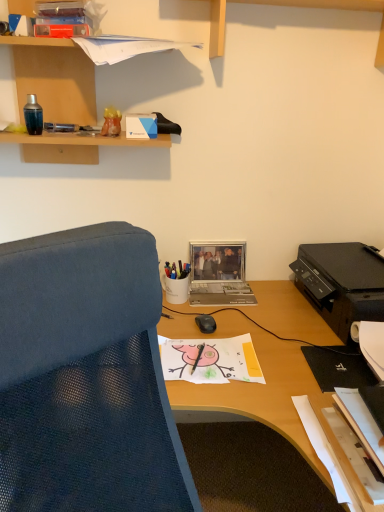
Question: Is metallic silver laptop at center facing away from black matte pen at center, marked as the 1th pen in a front-to-back arrangement?

Choices:
 (A) yes
 (B) no

Answer: (B)

Question: Does metallic silver laptop at center touch black matte pen at center, arranged as the 2th pen when viewed from the top?

Choices:
 (A) yes
 (B) no

Answer: (B)

Question: Considering the relative positions of metallic silver laptop at center and black matte pen at center, which is the first pen in bottom-to-top order, in the image provided, is metallic silver laptop at center to the left of black matte pen at center, which is the first pen in bottom-to-top order, from the viewer's perspective?

Choices:
 (A) yes
 (B) no

Answer: (B)

Question: From the image's perspective, is metallic silver laptop at center below black matte pen at center, which is the first pen in bottom-to-top order?

Choices:
 (A) yes
 (B) no

Answer: (B)

Question: Is the position of metallic silver laptop at center less distant than that of black matte pen at center, the second pen in the back-to-front sequence?

Choices:
 (A) no
 (B) yes

Answer: (A)

Question: Is black plastic printer at right situated inside translucent orange vase at upper left, placed as the first stationery when sorted from top to bottom, or outside?

Choices:
 (A) outside
 (B) inside

Answer: (A)

Question: From the image's perspective, relative to translucent orange vase at upper left, acting as the 1th stationery starting from the left, is black plastic printer at right above or below?

Choices:
 (A) below
 (B) above

Answer: (A)

Question: Is black plastic printer at right to the left or to the right of translucent orange vase at upper left, placed as the first stationery when sorted from top to bottom, in the image?

Choices:
 (A) left
 (B) right

Answer: (B)

Question: From a real-world perspective, relative to translucent orange vase at upper left, placed as the first stationery when sorted from top to bottom, is black plastic printer at right vertically above or below?

Choices:
 (A) below
 (B) above

Answer: (A)

Question: In terms of size, does white glossy pen holder at center, which is the first stationery from right to left, appear bigger or smaller than metallic pen at upper left, the second pen from the bottom?

Choices:
 (A) big
 (B) small

Answer: (A)

Question: From the image's perspective, is white glossy pen holder at center, which is the first stationery from right to left, positioned above or below metallic pen at upper left, the second pen from the bottom?

Choices:
 (A) above
 (B) below

Answer: (B)

Question: Choose the correct answer: Is white glossy pen holder at center, which ranks as the second stationery in front-to-back order, inside metallic pen at upper left, the second pen from the bottom, or outside it?

Choices:
 (A) inside
 (B) outside

Answer: (B)

Question: In the image, is white glossy pen holder at center, which ranks as the second stationery in front-to-back order, on the left side or the right side of metallic pen at upper left, positioned as the first pen in left-to-right order?

Choices:
 (A) right
 (B) left

Answer: (A)

Question: Based on their sizes in the image, would you say wooden shelf at upper left is bigger or smaller than translucent orange vase at upper left, positioned as the 2th stationery in right-to-left order?

Choices:
 (A) big
 (B) small

Answer: (A)

Question: Is wooden shelf at upper left situated inside translucent orange vase at upper left, placed as the first stationery when sorted from top to bottom, or outside?

Choices:
 (A) outside
 (B) inside

Answer: (A)